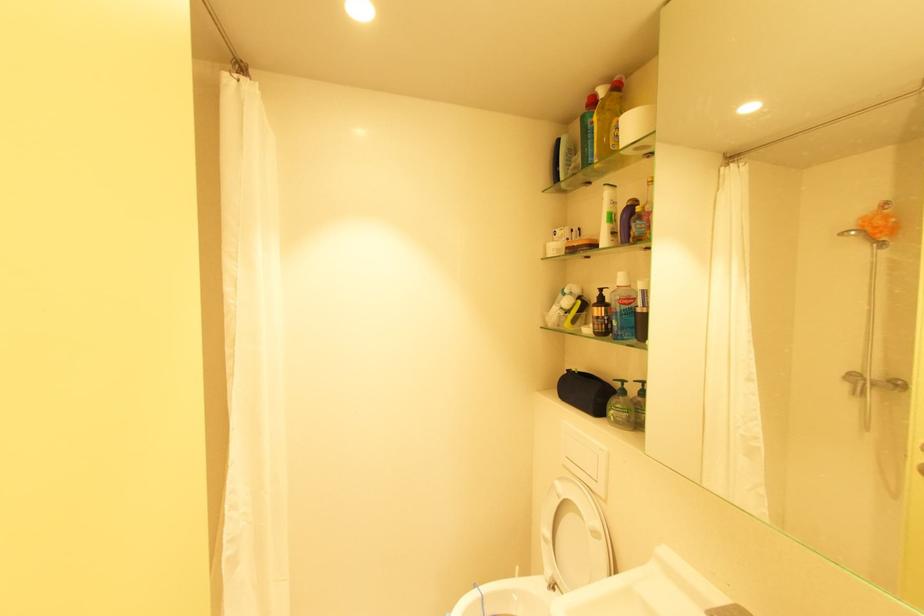
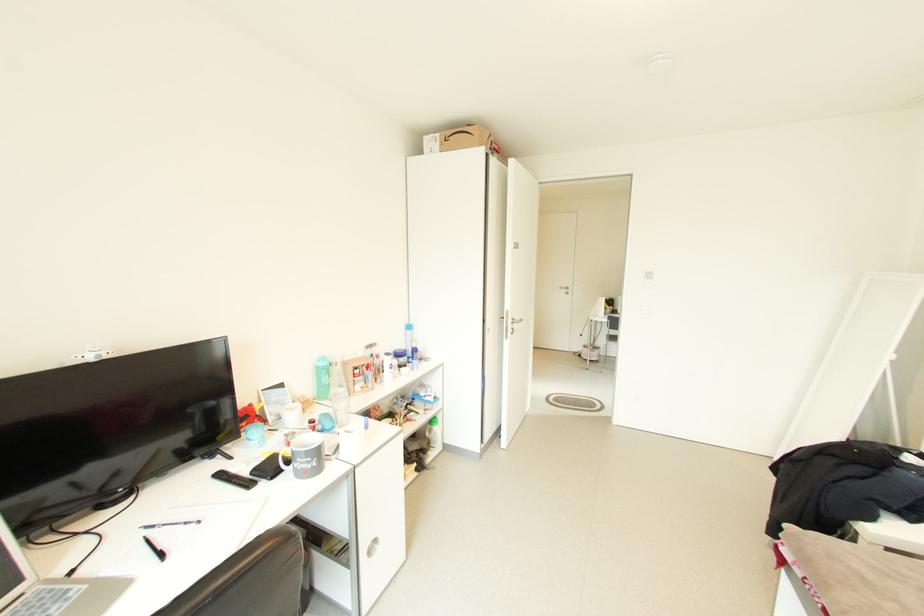
Question: I am providing you with two images of the same scene from different viewpoints. After the viewpoint changes to image2, which objects are now occluded?

Choices:
 (A) grey mug handle
 (B) round cabinet handle
 (C) beige nike bag
 (D) green pump dispenser head

Answer: (D)